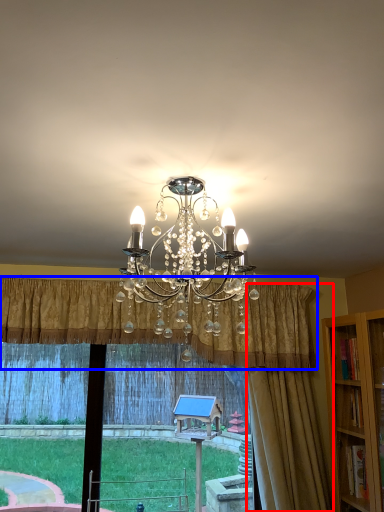
Question: Which object is further to the camera taking this photo, curtain (highlighted by a red box) or curtain (highlighted by a blue box)?

Choices:
 (A) curtain
 (B) curtain

Answer: (A)